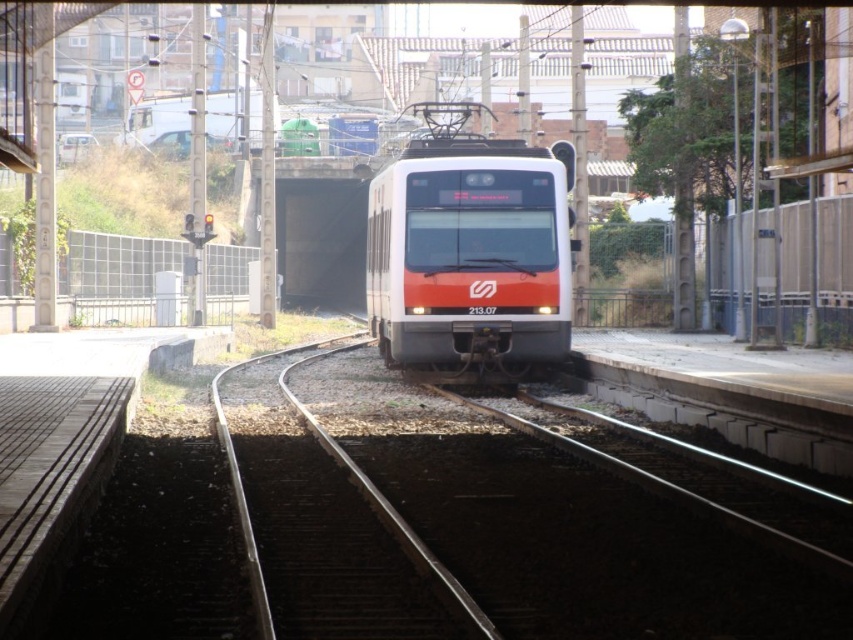
Is white glossy passenger train at center thinner than metal at center?

No, white glossy passenger train at center is not thinner than metal at center.

Between point (502, 276) and point (271, 356), which one is positioned behind?

Point (271, 356)

The image size is (853, 640). What are the coordinates of `white glossy passenger train at center` in the screenshot? It's located at (469, 259).

Who is more forward, (x=486, y=524) or (x=526, y=364)?

Point (x=486, y=524) is in front.

Who is positioned more to the right, metallic rail at center or white glossy passenger train at center?

From the viewer's perspective, white glossy passenger train at center appears more on the right side.

Who is more forward, (276, 368) or (482, 193)?

Point (482, 193)

You are a GUI agent. You are given a task and a screenshot of the screen. Output one action in this format:
    pyautogui.click(x=<x>, y=<y>)
    Task: Click on the metallic rail at center
    
    Given the screenshot: What is the action you would take?
    pyautogui.click(x=500, y=518)

Between metallic rail at center and metal at center, which one appears on the right side from the viewer's perspective?

metallic rail at center

Where is `metallic rail at center`? This screenshot has height=640, width=853. metallic rail at center is located at coordinates (500, 518).

This screenshot has height=640, width=853. Describe the element at coordinates (500, 518) in the screenshot. I see `metallic rail at center` at that location.

In order to click on metallic rail at center in this screenshot , I will do `click(500, 518)`.